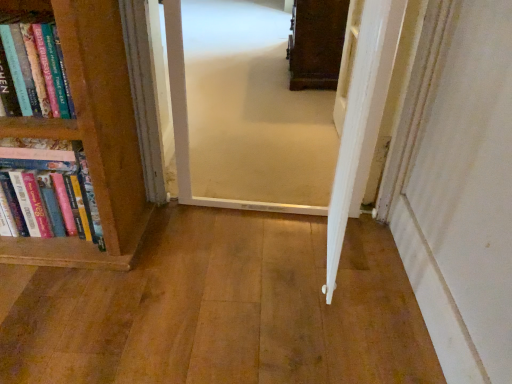
Question: Is wooden floor at center, arranged as the second corridor when viewed from the top, next to carpeted corridor at center, which appears as the second corridor when ordered from the bottom?

Choices:
 (A) yes
 (B) no

Answer: (B)

Question: Does wooden floor at center, which ranks as the first corridor in bottom-to-top order, have a lesser height compared to carpeted corridor at center, the first corridor from the top?

Choices:
 (A) no
 (B) yes

Answer: (B)

Question: Is wooden floor at center, which ranks as the first corridor in bottom-to-top order, to the left of carpeted corridor at center, which appears as the second corridor when ordered from the bottom, from the viewer's perspective?

Choices:
 (A) yes
 (B) no

Answer: (A)

Question: From the image's perspective, is wooden floor at center, arranged as the second corridor when viewed from the top, on top of carpeted corridor at center, the first corridor from the top?

Choices:
 (A) yes
 (B) no

Answer: (B)

Question: Is wooden floor at center, which ranks as the first corridor in bottom-to-top order, not within carpeted corridor at center, which appears as the second corridor when ordered from the bottom?

Choices:
 (A) yes
 (B) no

Answer: (A)

Question: Considering the positions of wooden floor at center, which ranks as the first corridor in bottom-to-top order, and hardcover books at left in the image, is wooden floor at center, which ranks as the first corridor in bottom-to-top order, bigger or smaller than hardcover books at left?

Choices:
 (A) small
 (B) big

Answer: (A)

Question: In terms of height, does wooden floor at center, which ranks as the first corridor in bottom-to-top order, look taller or shorter compared to hardcover books at left?

Choices:
 (A) tall
 (B) short

Answer: (B)

Question: In the image, is wooden floor at center, which ranks as the first corridor in bottom-to-top order, positioned in front of or behind hardcover books at left?

Choices:
 (A) front
 (B) behind

Answer: (A)

Question: From the image's perspective, is wooden floor at center, which ranks as the first corridor in bottom-to-top order, above or below hardcover books at left?

Choices:
 (A) above
 (B) below

Answer: (B)

Question: Is carpeted corridor at center, the first corridor from the top, inside the boundaries of wooden floor at center, which ranks as the first corridor in bottom-to-top order, or outside?

Choices:
 (A) outside
 (B) inside

Answer: (A)

Question: From the image's perspective, relative to wooden floor at center, which ranks as the first corridor in bottom-to-top order, is carpeted corridor at center, the first corridor from the top, above or below?

Choices:
 (A) below
 (B) above

Answer: (B)

Question: Is point (237, 173) closer or farther from the camera than point (421, 352)?

Choices:
 (A) farther
 (B) closer

Answer: (A)

Question: Looking at the image, does carpeted corridor at center, the first corridor from the top, seem bigger or smaller compared to wooden floor at center, which ranks as the first corridor in bottom-to-top order?

Choices:
 (A) small
 (B) big

Answer: (A)

Question: From the image's perspective, relative to carpeted corridor at center, which appears as the second corridor when ordered from the bottom, is wooden floor at center, which ranks as the first corridor in bottom-to-top order, above or below?

Choices:
 (A) above
 (B) below

Answer: (B)

Question: Based on their positions, is wooden floor at center, arranged as the second corridor when viewed from the top, located to the left or right of carpeted corridor at center, which appears as the second corridor when ordered from the bottom?

Choices:
 (A) right
 (B) left

Answer: (B)